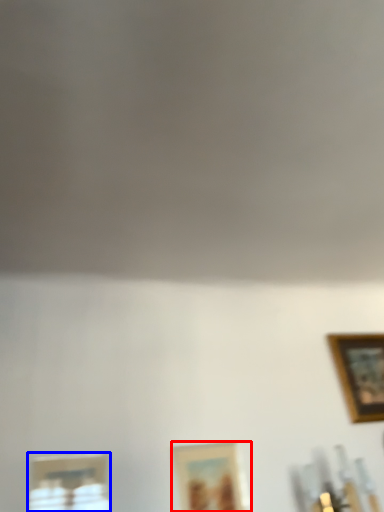
Question: Which object is further to the camera taking this photo, picture frame (highlighted by a red box) or picture frame (highlighted by a blue box)?

Choices:
 (A) picture frame
 (B) picture frame

Answer: (A)